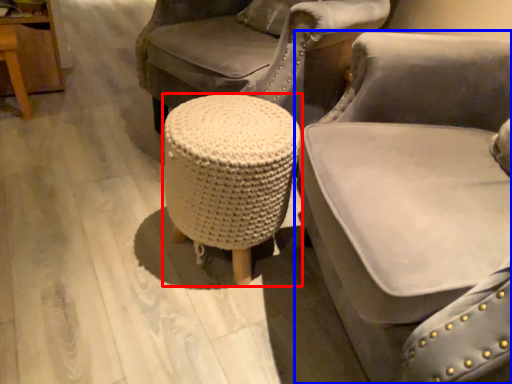
Question: Among these objects, which one is farthest to the camera, stool (highlighted by a red box) or chair (highlighted by a blue box)?

Choices:
 (A) stool
 (B) chair

Answer: (A)